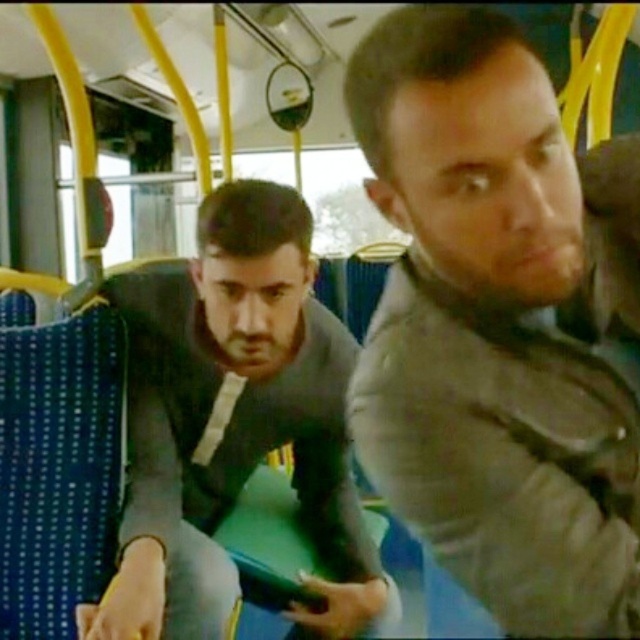
Which is more to the right, gray fabric jacket at center or gray matte jacket at center?

From the viewer's perspective, gray fabric jacket at center appears more on the right side.

The image size is (640, 640). In order to click on gray fabric jacket at center in this screenshot , I will do `click(499, 324)`.

The image size is (640, 640). What are the coordinates of `gray fabric jacket at center` in the screenshot? It's located at (499, 324).